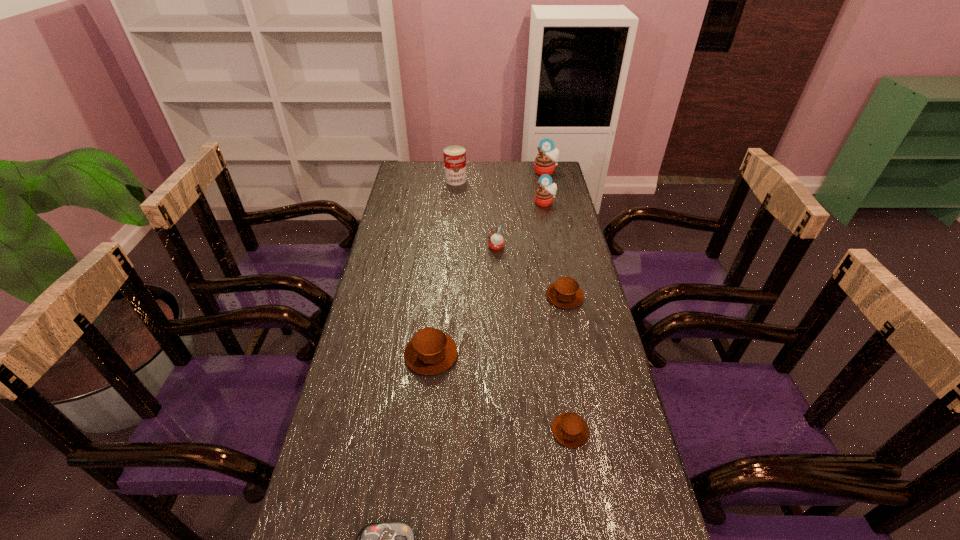
At what (x,y) coordinates should I click in order to perform the action: click on vacant area between the can and the second nearest brown muffin. Please return your answer as a coordinate pair (x, y). Looking at the image, I should click on (444, 267).

Find the location of `vacant area that lies between the fifth tallest muffin and the nearest muffin`. vacant area that lies between the fifth tallest muffin and the nearest muffin is located at coordinates (567, 363).

Locate an element on the screen. Image resolution: width=960 pixels, height=540 pixels. vacant area that lies between the fourth nearest muffin and the leftmost muffin is located at coordinates (464, 300).

What are the coordinates of `vacant space in between the nearest brown muffin and the sixth farthest object` in the screenshot? It's located at (501, 393).

Find the location of a particular element. This screenshot has width=960, height=540. free space between the nearest brown muffin and the second nearest brown muffin is located at coordinates (501, 393).

Identify which object is the nearest to the second farthest brown muffin. Please provide its 2D coordinates. Your answer should be formatted as a tuple, i.e. [(x, y)], where the tuple contains the x and y coordinates of a point satisfying the conditions above.

[(569, 429)]

Select which object is the third closest to the nearest brown muffin. Please provide its 2D coordinates. Your answer should be formatted as a tuple, i.e. [(x, y)], where the tuple contains the x and y coordinates of a point satisfying the conditions above.

[(565, 293)]

Locate an element on the screen. The height and width of the screenshot is (540, 960). muffin object that ranks as the third closest to the farthest muffin is located at coordinates (565, 293).

In order to click on the fourth closest muffin to the nearest brown muffin in this screenshot , I will do `click(544, 195)`.

Select which pink muffin appears as the third closest to the nearest muffin. Please provide its 2D coordinates. Your answer should be formatted as a tuple, i.e. [(x, y)], where the tuple contains the x and y coordinates of a point satisfying the conditions above.

[(545, 162)]